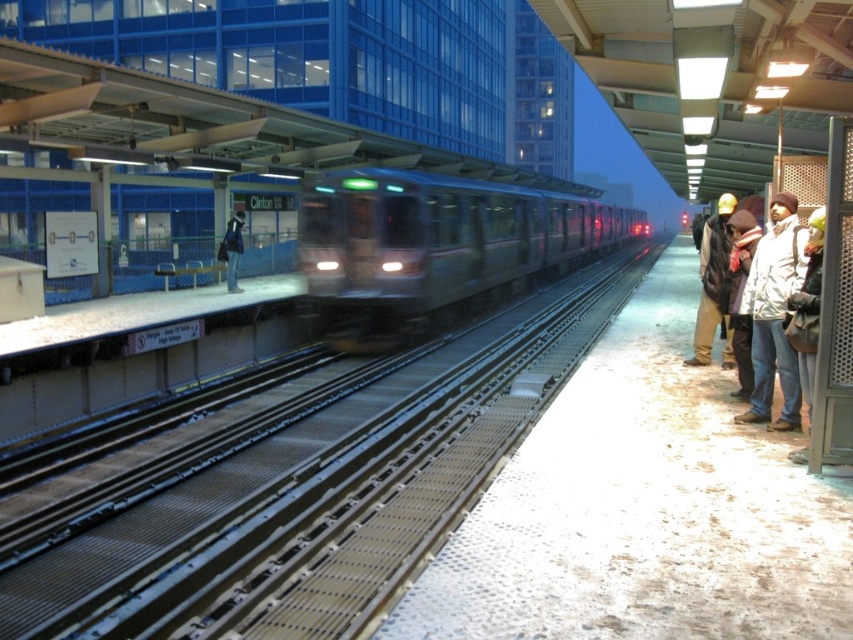
What do you see at coordinates (434, 244) in the screenshot?
I see `metallic silver train at center` at bounding box center [434, 244].

Does point (496, 300) come behind point (773, 264)?

That is True.

In order to click on metallic silver train at center in this screenshot , I will do `click(434, 244)`.

Does metallic silver train at center appear on the right side of dark blue jacket at center?

Yes, metallic silver train at center is to the right of dark blue jacket at center.

Can you confirm if metallic silver train at center is positioned to the left of dark blue jacket at center?

In fact, metallic silver train at center is to the right of dark blue jacket at center.

Does point (393, 188) come closer to viewer compared to point (233, 250)?

Yes, it is.

Locate an element on the screen. metallic silver train at center is located at coordinates (434, 244).

This screenshot has width=853, height=640. What do you see at coordinates (773, 314) in the screenshot?
I see `brown woolen hat at right` at bounding box center [773, 314].

Is brown woolen hat at right bigger than dark blue jacket at center?

Yes.

Locate an element on the screen. brown woolen hat at right is located at coordinates (773, 314).